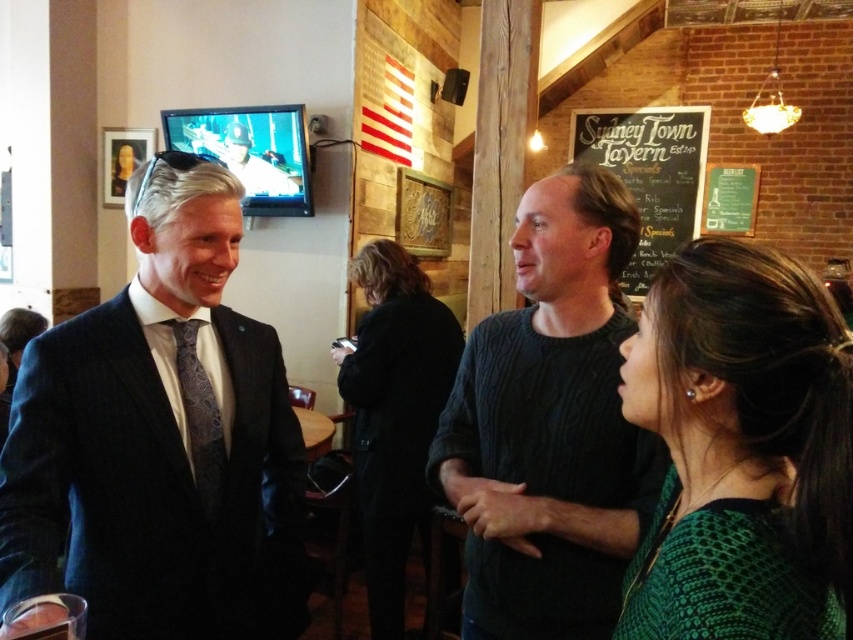
Between point (253, 397) and point (840, 609), which one is positioned behind?

The point (253, 397) is more distant.

Locate an element on the screen. This screenshot has height=640, width=853. matte black suit at left is located at coordinates (160, 440).

Is point (735, 352) positioned before point (196, 406)?

That is True.

Who is positioned more to the right, green textured sweater at lower right or dark blue textured tie at left?

Positioned to the right is green textured sweater at lower right.

Which is behind, point (751, 330) or point (215, 488)?

Positioned behind is point (215, 488).

I want to click on green textured sweater at lower right, so point(741,449).

Between green textured sweater at lower right and dark knit sweater at center, which one appears on the left side from the viewer's perspective?

Positioned to the left is dark knit sweater at center.

Who is shorter, green textured sweater at lower right or dark knit sweater at center?

green textured sweater at lower right is shorter.

Who is more distant from viewer, (763, 356) or (567, 424)?

Point (567, 424)

Find the location of a particular element. The width and height of the screenshot is (853, 640). green textured sweater at lower right is located at coordinates (741, 449).